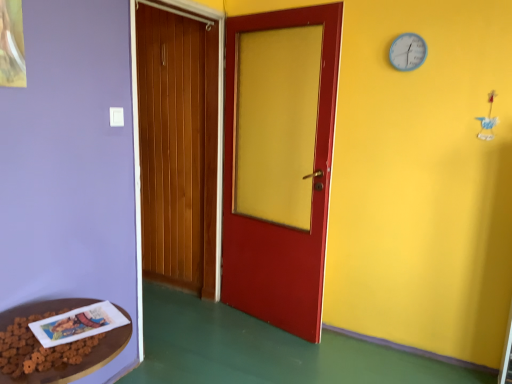
Image resolution: width=512 pixels, height=384 pixels. In order to click on free space above brown wooden table at lower left (from a real-world perspective) in this screenshot , I will do coord(48,329).